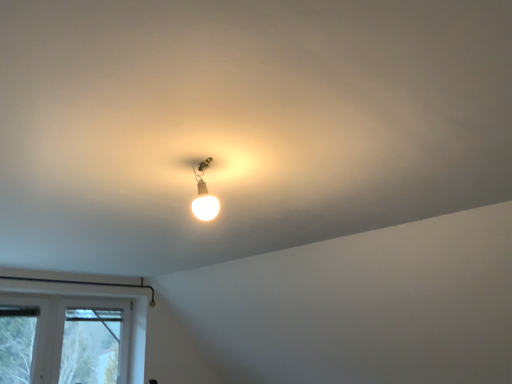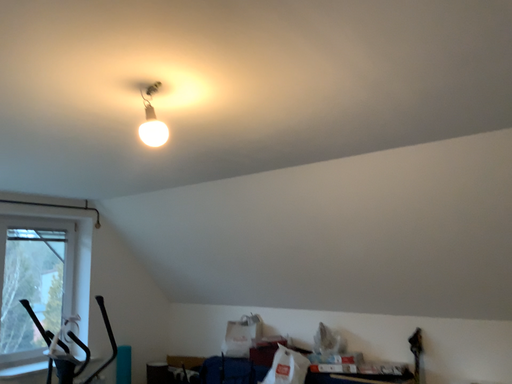
Question: How did the camera likely rotate when shooting the video?

Choices:
 (A) rotated downward
 (B) rotated upward

Answer: (A)